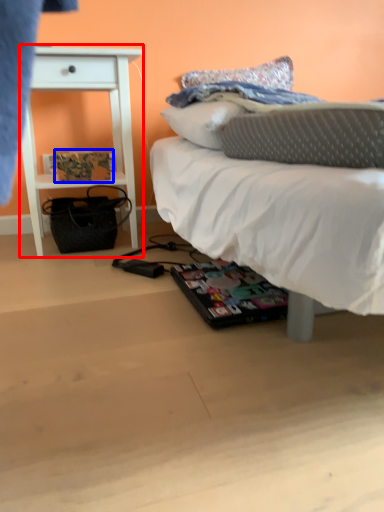
Question: Which point is further to the camera, nightstand (highlighted by a red box) or magazine (highlighted by a blue box)?

Choices:
 (A) nightstand
 (B) magazine

Answer: (B)